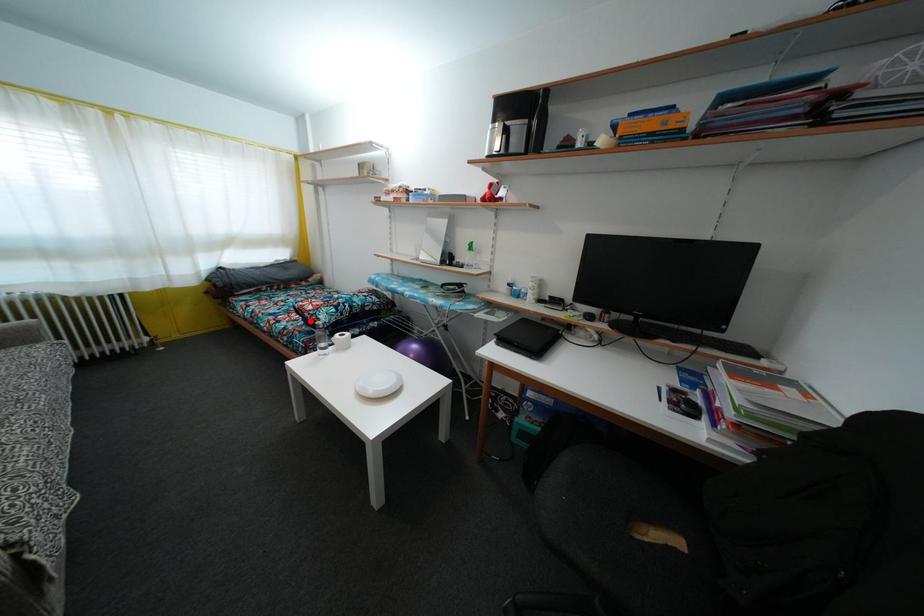
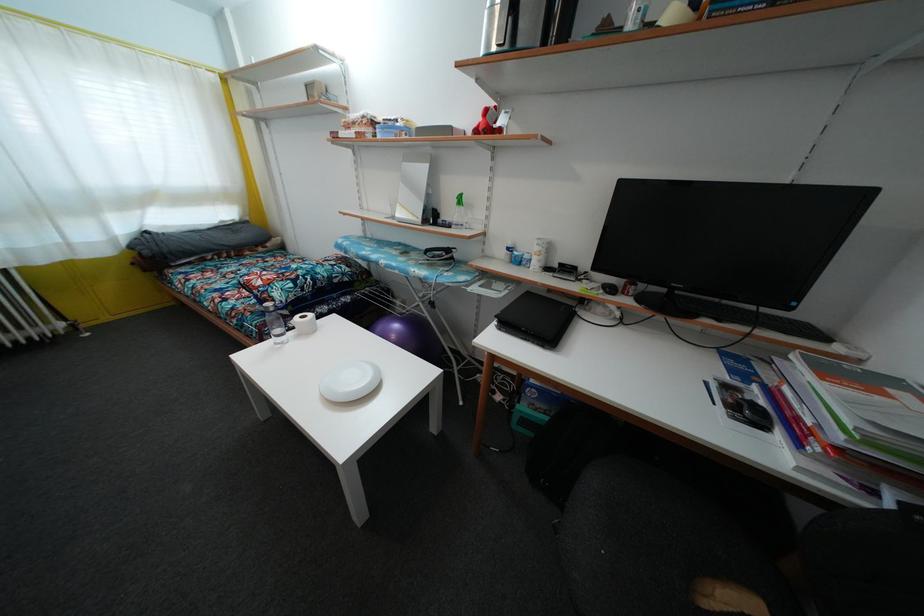
Where in the second image is the point corresponding to the highlighted location from the first image?

(259, 299)